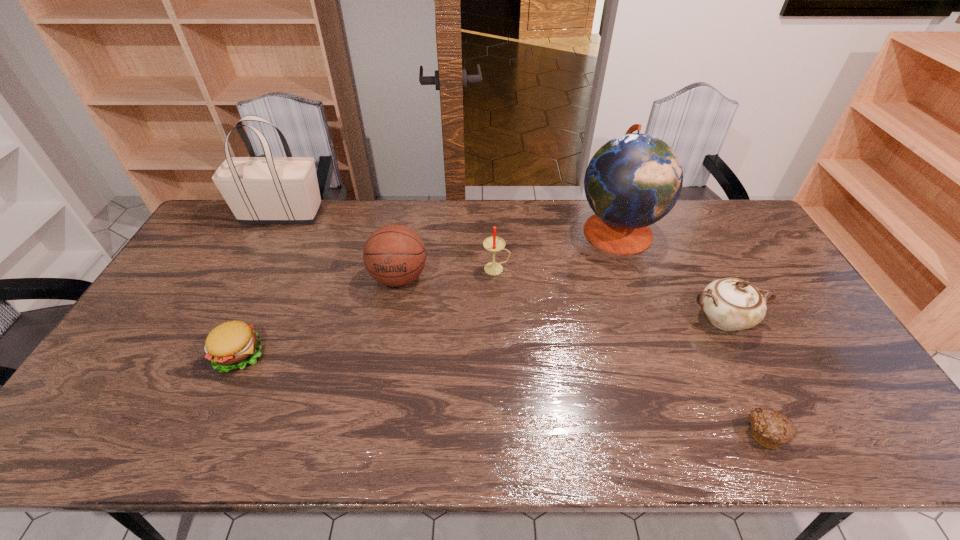
Find the location of a particular element. Image resolution: width=960 pixels, height=540 pixels. free space that satisfies the following two spatial constraints: 1. on the back side of the candle; 2. on the right side of the hamburger is located at coordinates (279, 269).

Where is `vacant space that satisfies the following two spatial constraints: 1. with the Americas facing the viewer on the globe; 2. on the right side of the chinaware`? The width and height of the screenshot is (960, 540). vacant space that satisfies the following two spatial constraints: 1. with the Americas facing the viewer on the globe; 2. on the right side of the chinaware is located at coordinates (648, 319).

I want to click on vacant space that satisfies the following two spatial constraints: 1. on the front side of the candle; 2. on the left side of the chinaware, so click(498, 319).